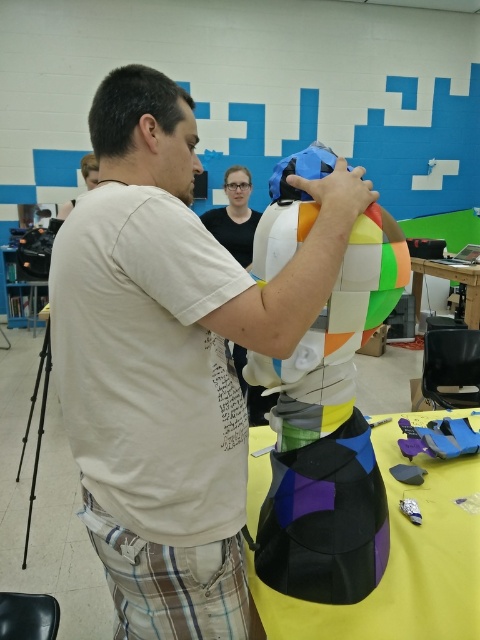
You are an observer in the workshop. You see the multicolored paper mache mask at center and the black fabric table at center. Which object is closer to you?

The multicolored paper mache mask at center is closer to you because it is in front of the black fabric table at center.

You are an artist observing a scene where a person is working on a project. You notice the matte white shirt at center and the multicolored paper mache mask at center. Which object is wider?

The matte white shirt at center is wider than the multicolored paper mache mask at center.

Based on the photo, you are standing in the workshop and want to locate the person wearing the matte white shirt at center. According to the coordinates provided, where would you look relative to the image frame?

The matte white shirt at center is located at the coordinates point (170, 358), which is slightly to the right and lower middle of the image frame.